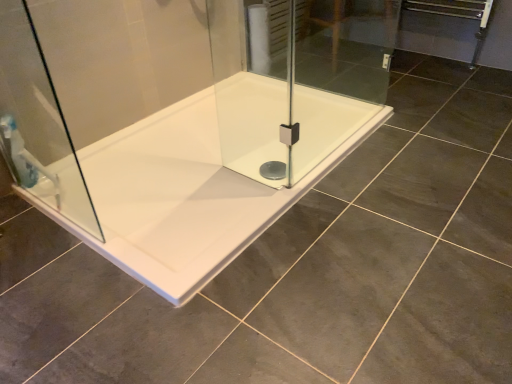
Locate an element on the screen. This screenshot has width=512, height=384. free location in front of white glossy bathtub at center is located at coordinates (270, 296).